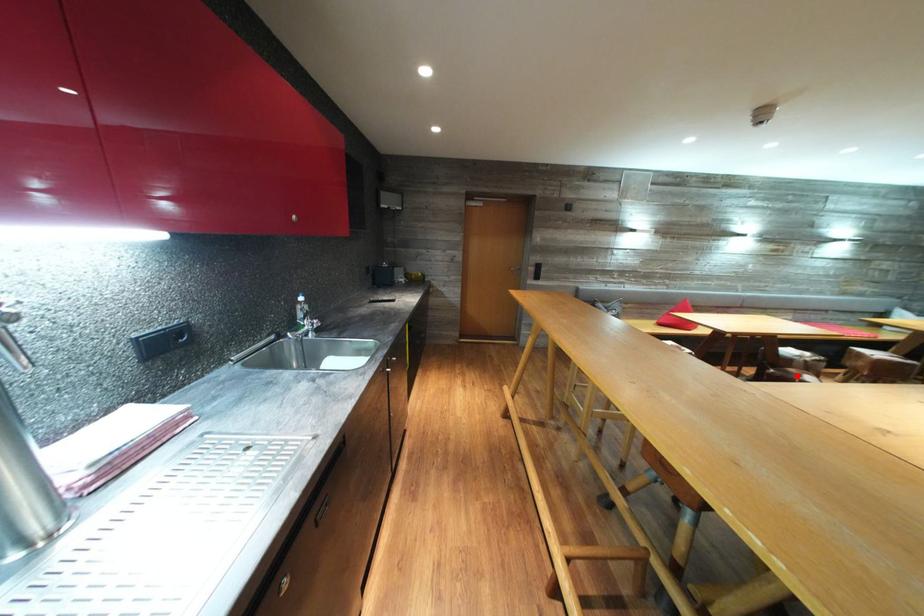
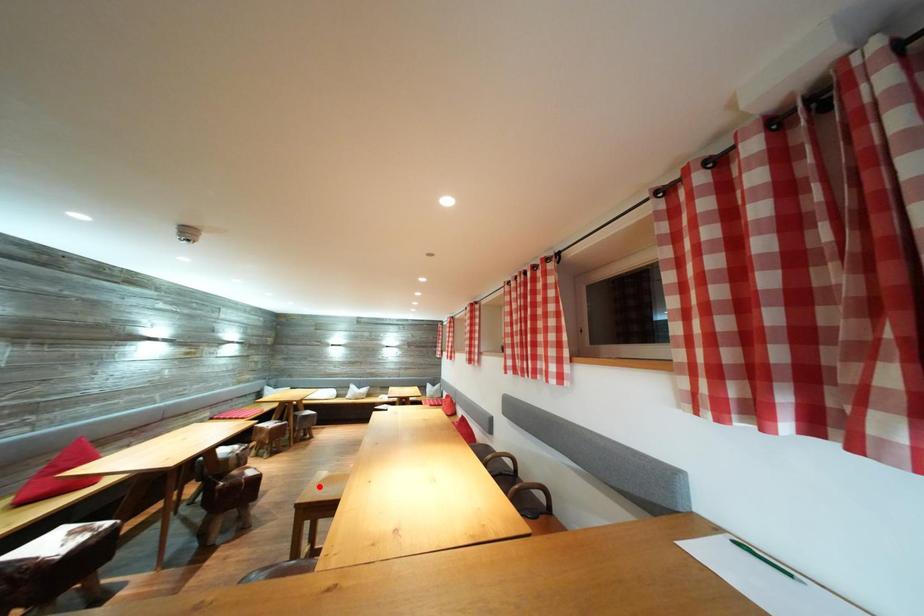
I am providing you with two images of the same scene from different viewpoints. A red point is marked on the first image and another point is marked on the second image. Do the highlighted points in image1 and image2 indicate the same real-world spot?

No